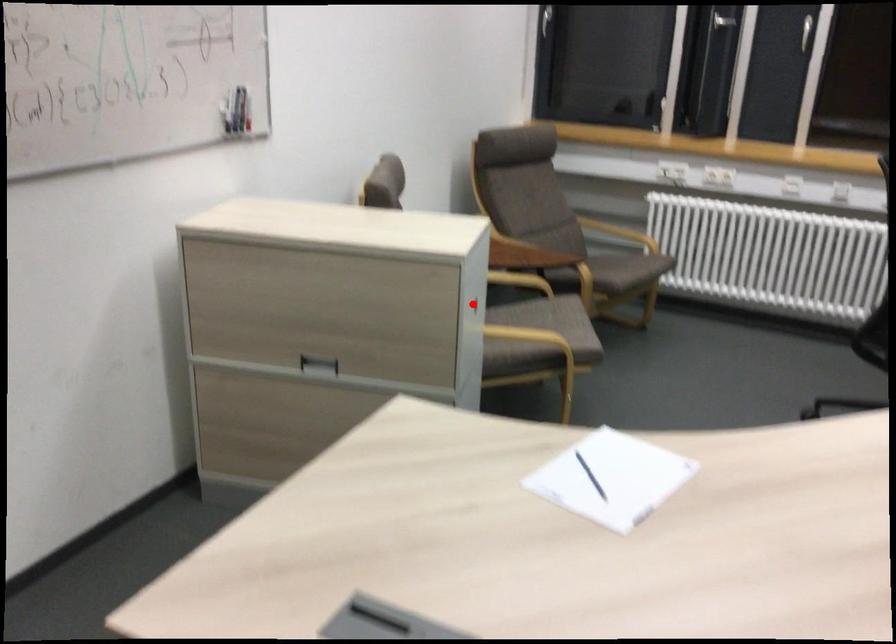
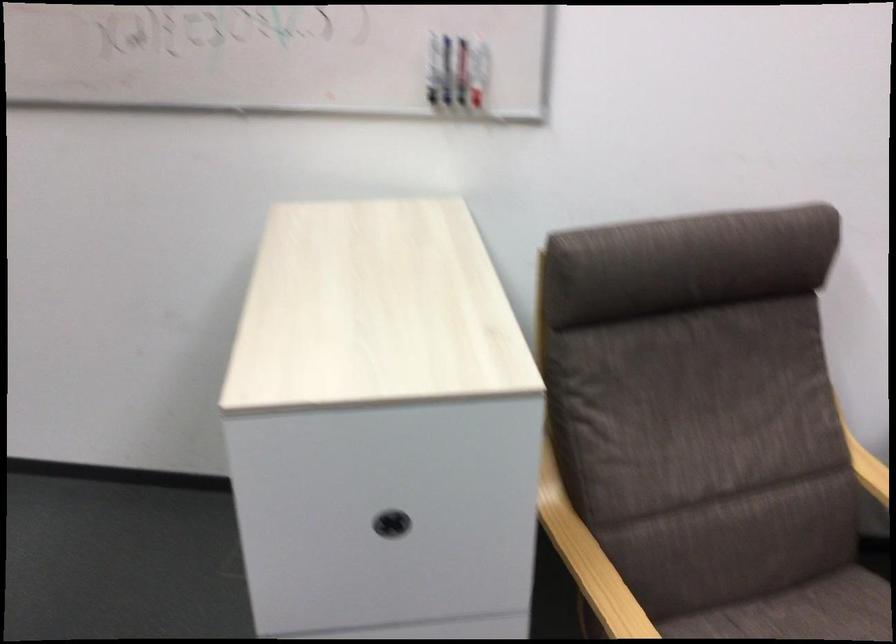
Question: I am providing you with two images of the same scene from different viewpoints. Given a red point in image1, look at the same physical point in image2. Is it:

Choices:
 (A) Closer to the viewpoint
 (B) Farther from the viewpoint

Answer: (A)